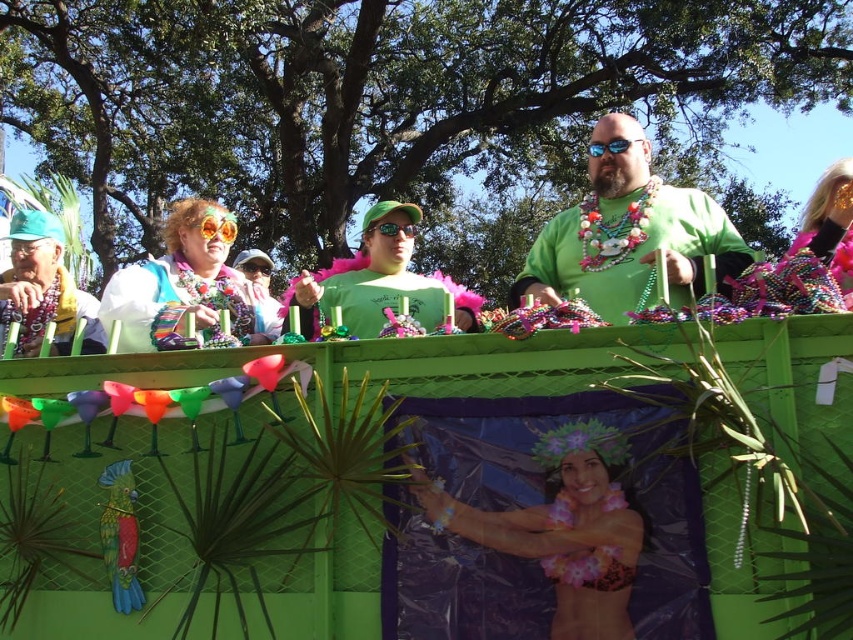
Question: Can you confirm if green feather boa at center is positioned above matte green shirt at left?

Choices:
 (A) no
 (B) yes

Answer: (B)

Question: Which point appears closest to the camera in this image?

Choices:
 (A) (24, 284)
 (B) (610, 125)
 (C) (149, 310)

Answer: (C)

Question: Which object is positioned closest to the green matte shirt at center?

Choices:
 (A) matte green shirt at left
 (B) green feather boa at center
 (C) white fabric with colorful beads at left
 (D) floral bikini at center

Answer: (B)

Question: Is green matte shirt at center below floral bikini at center?

Choices:
 (A) no
 (B) yes

Answer: (A)

Question: Does green feather boa at center have a larger size compared to matte green shirt at left?

Choices:
 (A) no
 (B) yes

Answer: (B)

Question: Among these objects, which one is farthest from the camera?

Choices:
 (A) floral bikini at center
 (B) matte green shirt at left

Answer: (B)